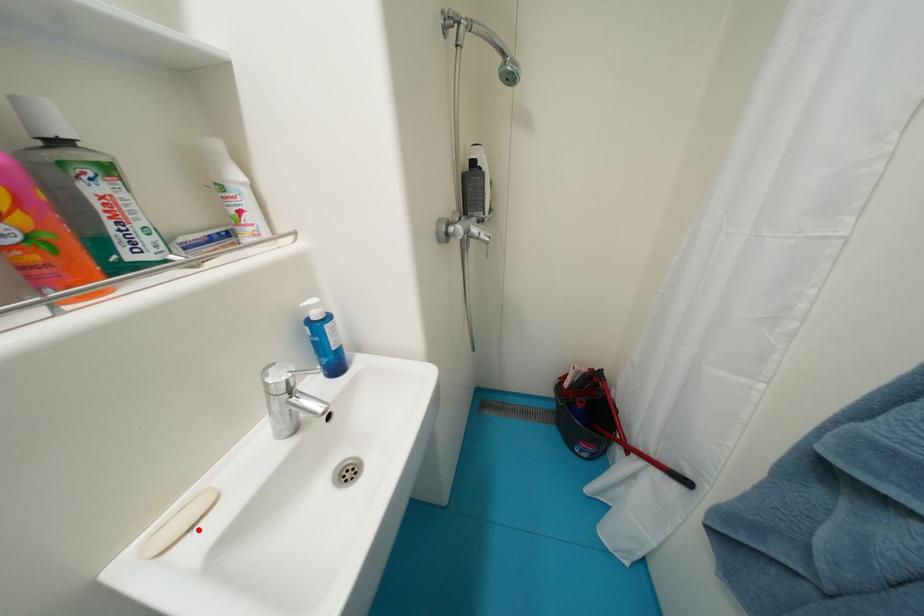
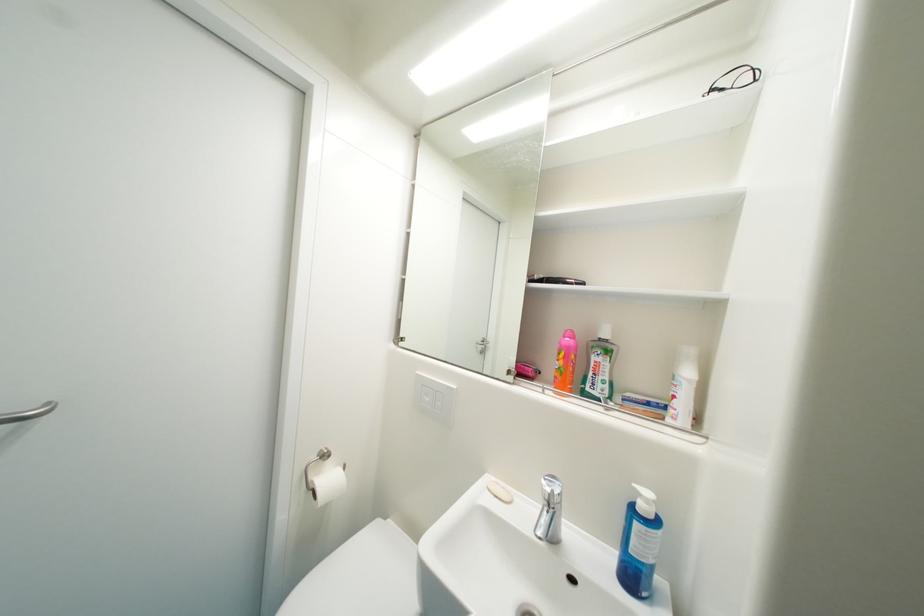
Find the pixel in the second image that matches the highlighted location in the first image.

(503, 498)